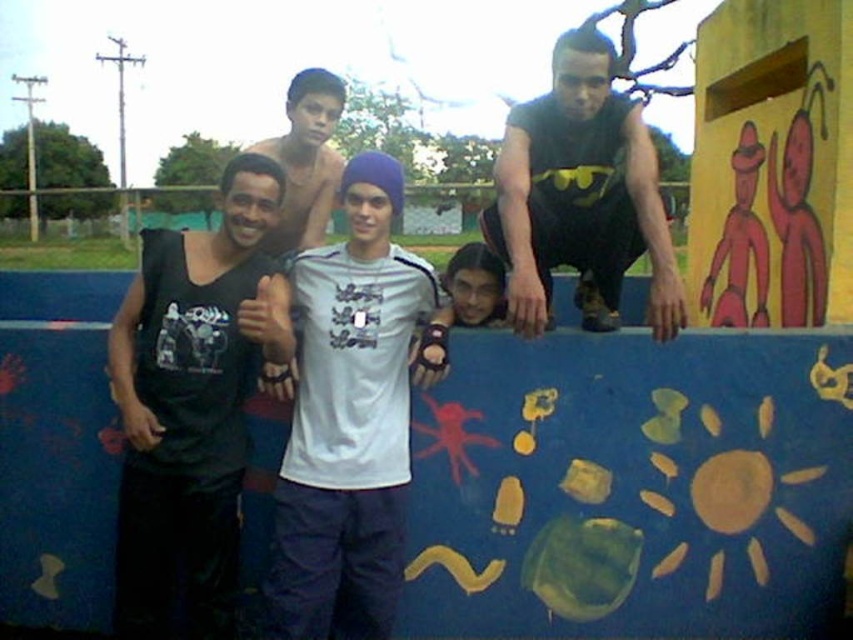
Question: Which of the following is the closest to the observer?

Choices:
 (A) (310, 147)
 (B) (677, 310)

Answer: (B)

Question: Which of the following is the closest to the observer?

Choices:
 (A) (189, 230)
 (B) (485, 294)

Answer: (A)

Question: Does white matte t-shirt at center have a lesser width compared to smooth skin face at center?

Choices:
 (A) no
 (B) yes

Answer: (A)

Question: Observing the image, what is the correct spatial positioning of black matte tank top at upper right in reference to smooth skin face at center?

Choices:
 (A) above
 (B) below

Answer: (A)

Question: Which point appears farthest from the camera in this image?

Choices:
 (A) (532, 161)
 (B) (467, 266)
 (C) (160, 378)

Answer: (A)

Question: Is white matte t-shirt at center wider than smooth skin face at center?

Choices:
 (A) yes
 (B) no

Answer: (A)